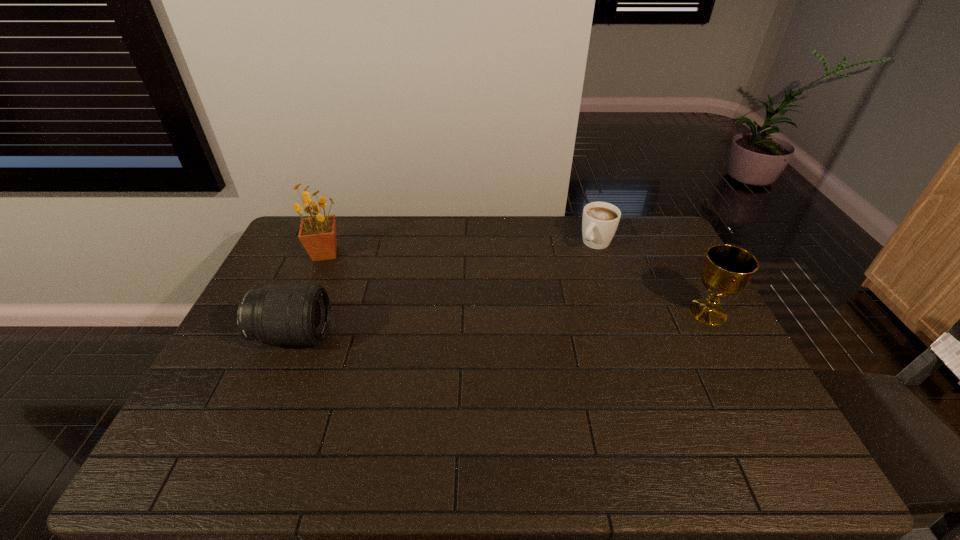
Where is `vacant space located 0.150m with the handle on the side of the cappuccino`? The width and height of the screenshot is (960, 540). vacant space located 0.150m with the handle on the side of the cappuccino is located at coordinates (566, 275).

At what (x,y) coordinates should I click in order to perform the action: click on free spot located at the front of the sunflower with flowers visible. Please return your answer as a coordinate pair (x, y). Looking at the image, I should click on (384, 282).

Identify the location of free space located at the front of the sunflower with flowers visible. The image size is (960, 540). (398, 289).

The width and height of the screenshot is (960, 540). Identify the location of vacant space located at the front of the sunflower with flowers visible. (375, 278).

In order to click on cappuccino that is at the far edge in this screenshot , I will do `click(600, 220)`.

The width and height of the screenshot is (960, 540). I want to click on sunflower that is positioned at the far edge, so click(x=317, y=233).

You are a GUI agent. You are given a task and a screenshot of the screen. Output one action in this format:
    pyautogui.click(x=<x>, y=<y>)
    Task: Click on the telephoto lens that is positioned at the left edge
    
    Given the screenshot: What is the action you would take?
    pyautogui.click(x=300, y=314)

You are a GUI agent. You are given a task and a screenshot of the screen. Output one action in this format:
    pyautogui.click(x=<x>, y=<y>)
    Task: Click on the sunflower located in the left edge section of the desktop
    The width and height of the screenshot is (960, 540).
    Given the screenshot: What is the action you would take?
    pyautogui.click(x=317, y=233)

Where is `object at the right edge`? This screenshot has width=960, height=540. object at the right edge is located at coordinates (727, 269).

This screenshot has height=540, width=960. Identify the location of object that is at the far left corner. [x=317, y=233].